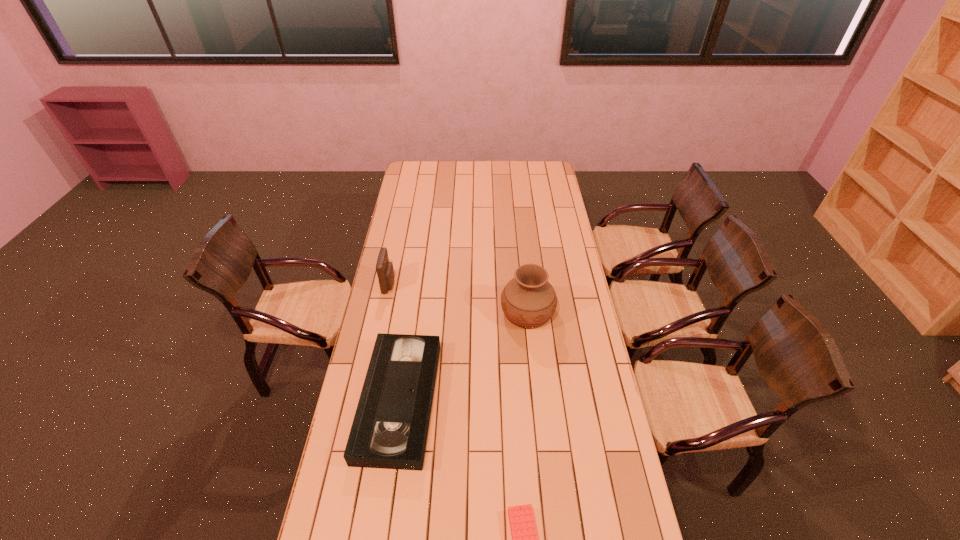
Find the location of a particular element. vacant space that satisfies the following two spatial constraints: 1. with an open flap on the tallest object; 2. on the right side of the second tallest object is located at coordinates (384, 312).

Image resolution: width=960 pixels, height=540 pixels. I want to click on free region that satisfies the following two spatial constraints: 1. with an open flap on the second tallest object; 2. on the back side of the third farthest object, so click(x=365, y=401).

The width and height of the screenshot is (960, 540). I want to click on vacant space that satisfies the following two spatial constraints: 1. with an open flap on the third shortest object; 2. on the back side of the second shortest object, so click(x=365, y=401).

Identify the location of free space that satisfies the following two spatial constraints: 1. on the back side of the third tallest object; 2. with an open flap on the second tallest object. pyautogui.click(x=417, y=284).